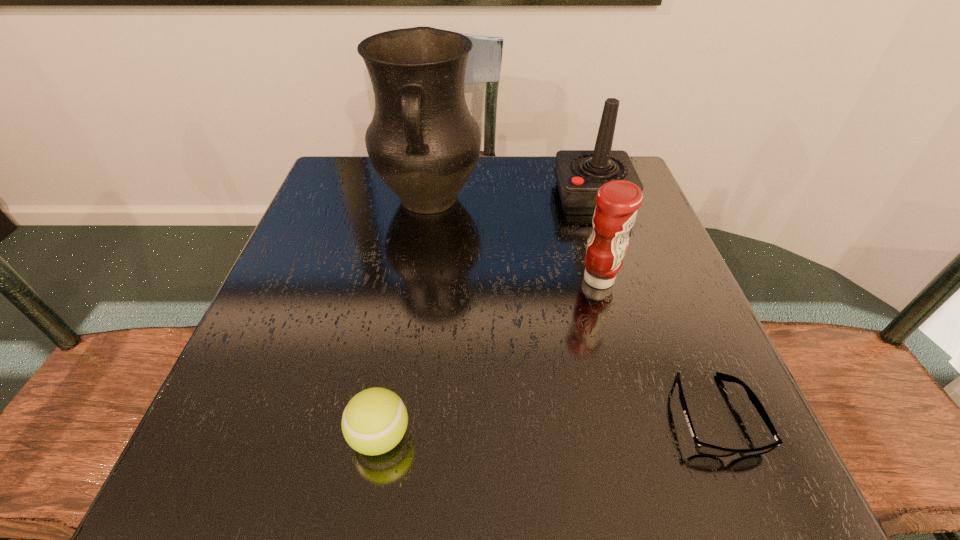
Where is `free space that is in between the second shortest object and the sunglasses`? free space that is in between the second shortest object and the sunglasses is located at coordinates click(546, 426).

This screenshot has height=540, width=960. I want to click on vacant region between the third shortest object and the sunglasses, so click(656, 347).

Identify the location of empty location between the fourth tallest object and the joystick. click(x=486, y=316).

Find the location of a particular element. The height and width of the screenshot is (540, 960). free space that is in between the joystick and the tallest object is located at coordinates (511, 198).

Where is `blank region between the sunglasses and the third farthest object`? blank region between the sunglasses and the third farthest object is located at coordinates (656, 347).

Find the location of a particular element. Image resolution: width=960 pixels, height=540 pixels. vacant area that lies between the joystick and the shortest object is located at coordinates (653, 306).

Find the location of a particular element. This screenshot has width=960, height=540. free spot between the tennis ball and the joystick is located at coordinates (486, 316).

Where is `free space between the second shortest object and the shortest object`? This screenshot has height=540, width=960. free space between the second shortest object and the shortest object is located at coordinates (546, 426).

Where is `vacant point located between the shortest object and the tallest object`? The height and width of the screenshot is (540, 960). vacant point located between the shortest object and the tallest object is located at coordinates (571, 307).

Locate an element on the screen. Image resolution: width=960 pixels, height=540 pixels. vacant space that's between the third tallest object and the sunglasses is located at coordinates (656, 347).